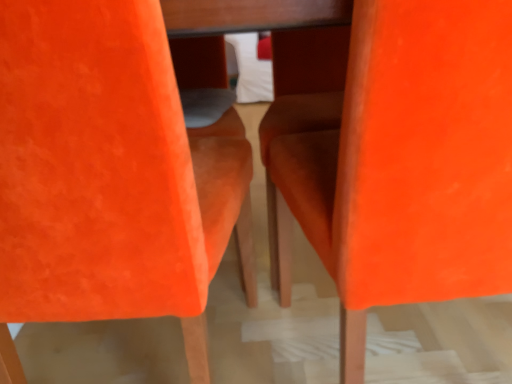
Question: Is point (x=8, y=340) positioned closer to the camera than point (x=397, y=82)?

Choices:
 (A) farther
 (B) closer

Answer: (A)

Question: In terms of width, does orange suede chair at center, the 2th chair when ordered from right to left, look wider or thinner when compared to orange velvet chair at center, arranged as the 2th chair when viewed from the left?

Choices:
 (A) wide
 (B) thin

Answer: (A)

Question: Considering the positions of orange suede chair at center, which is counted as the 1th chair, starting from the left, and orange velvet chair at center, arranged as the 2th chair when viewed from the left, in the image, is orange suede chair at center, which is counted as the 1th chair, starting from the left, taller or shorter than orange velvet chair at center, arranged as the 2th chair when viewed from the left,?

Choices:
 (A) short
 (B) tall

Answer: (B)

Question: Would you say orange velvet chair at center, arranged as the 2th chair when viewed from the left, is to the left or to the right of orange suede chair at center, which is counted as the 1th chair, starting from the left, in the picture?

Choices:
 (A) left
 (B) right

Answer: (B)

Question: Relative to orange suede chair at center, the 2th chair when ordered from right to left, is orange velvet chair at center, placed as the first chair when sorted from right to left, in front or behind?

Choices:
 (A) behind
 (B) front

Answer: (A)

Question: Considering the positions of orange velvet chair at center, arranged as the 2th chair when viewed from the left, and orange suede chair at center, which is counted as the 1th chair, starting from the left, in the image, is orange velvet chair at center, arranged as the 2th chair when viewed from the left, wider or thinner than orange suede chair at center, which is counted as the 1th chair, starting from the left,?

Choices:
 (A) thin
 (B) wide

Answer: (A)

Question: Is orange velvet chair at center, placed as the first chair when sorted from right to left, spatially inside orange suede chair at center, which is counted as the 1th chair, starting from the left, or outside of it?

Choices:
 (A) outside
 (B) inside

Answer: (A)